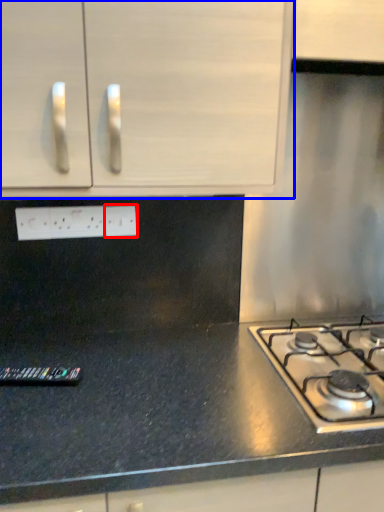
Question: Which of the following is the closest to the observer, electric outlet (highlighted by a red box) or cabinetry (highlighted by a blue box)?

Choices:
 (A) electric outlet
 (B) cabinetry

Answer: (B)